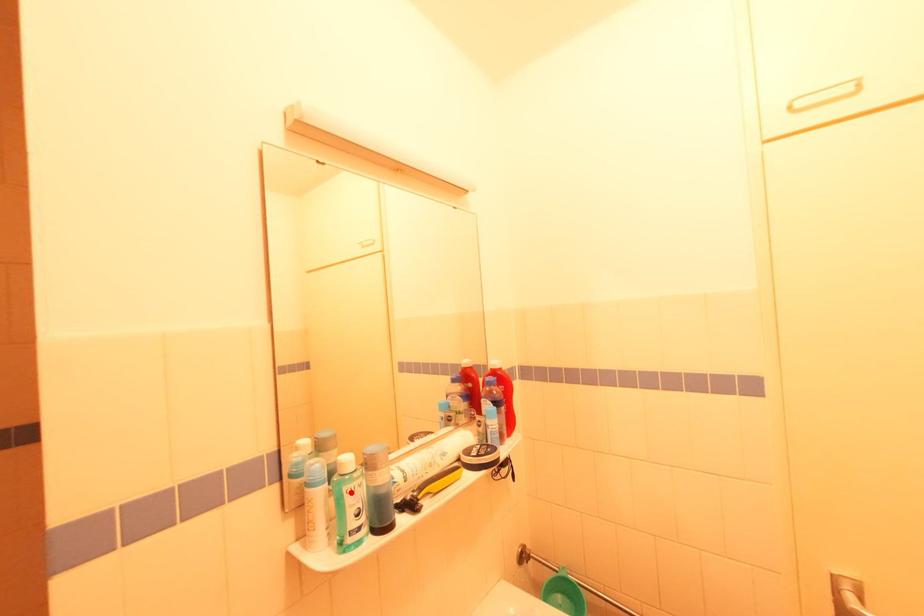
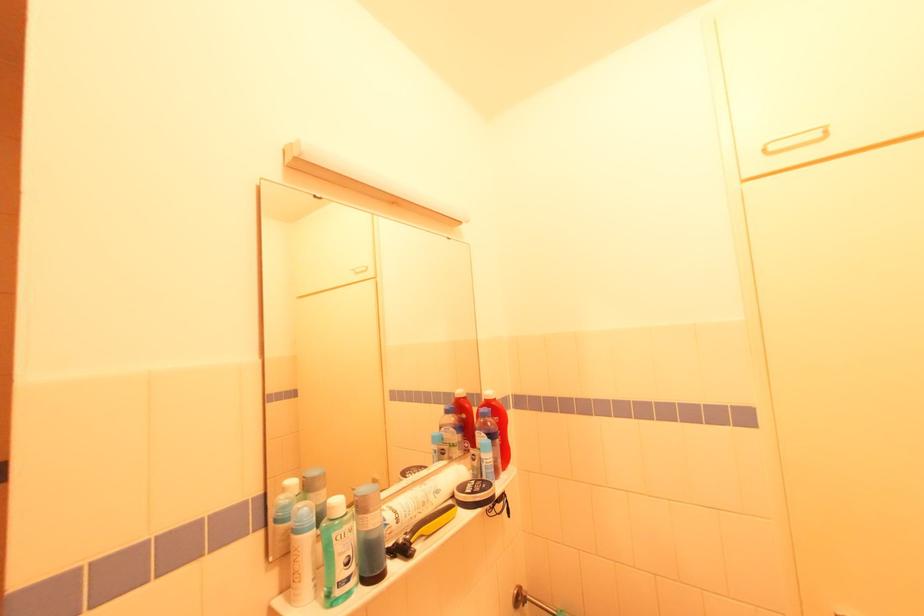
In the second image, find the point that corresponds to the highlighted location in the first image.

(341, 539)